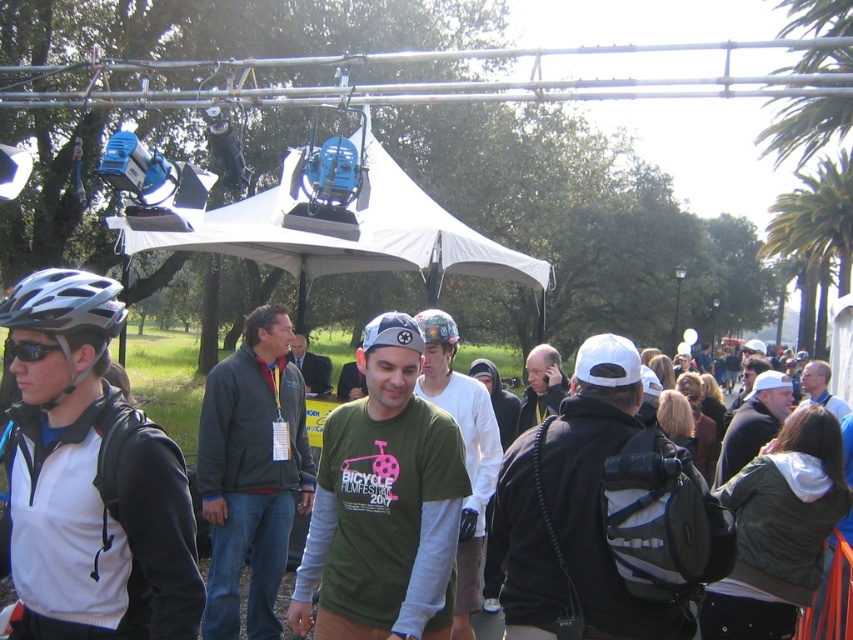
Measure the distance between point [595,616] and camera.

Point [595,616] is 9.63 feet away from camera.

In the scene shown: Between dark green t-shirt at center and green matte shirt at center, which one has less height?

dark green t-shirt at center is shorter.

Is point (657, 602) more distant than point (379, 545)?

No, it is in front of (379, 545).

At what (x,y) coordinates should I click in order to perform the action: click on dark green t-shirt at center. Please return your answer as a coordinate pair (x, y). Looking at the image, I should click on pyautogui.click(x=604, y=515).

Is point (608, 371) positioned after point (22, 304)?

Yes, point (608, 371) is farther from viewer.

Between point (498, 486) and point (56, 289), which one is positioned in front?

Point (56, 289) is more forward.

The image size is (853, 640). I want to click on dark green t-shirt at center, so click(604, 515).

Find the location of a particular element. dark green t-shirt at center is located at coordinates (604, 515).

Which is in front, point (445, 321) or point (28, 358)?

Point (28, 358) is in front.

Is point (418, 328) positioned before point (25, 353)?

No.

Is point (440, 333) positioned behind point (16, 348)?

Yes, it is behind point (16, 348).

Find the location of a particular element. This screenshot has height=640, width=853. matte black bicycle helmet at center is located at coordinates (436, 326).